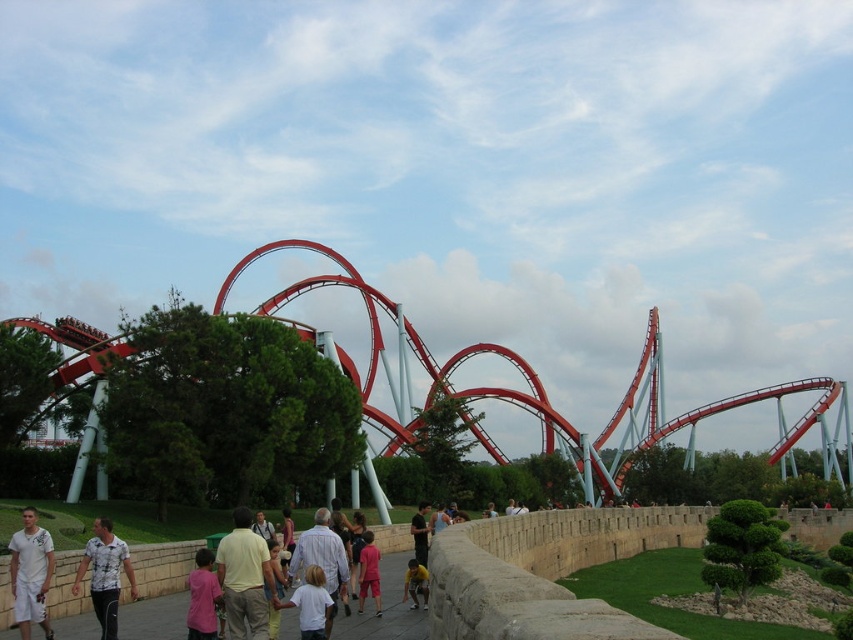
You are a visitor at the amusement park and want to take a photo of the glossy steel roller coaster at center from the white stone pathway at center. Can you see the entire roller coaster in your photo without moving your position?

The glossy steel roller coaster at center is above the white stone pathway at center, so yes, you can see the entire roller coaster in your photo without moving your position because the roller coaster is elevated and not obstructed by the pathway.

You are a photographer planning to take a photo of the pink fabric shirt at lower center and the pink fabric pants at center. To ensure both are fully visible in the frame, which object should you focus on first, the one that is wider?

The pink fabric shirt at lower center might be wider than pink fabric pants at center, so you should focus on the pink fabric shirt at lower center first to ensure it fits in the frame.